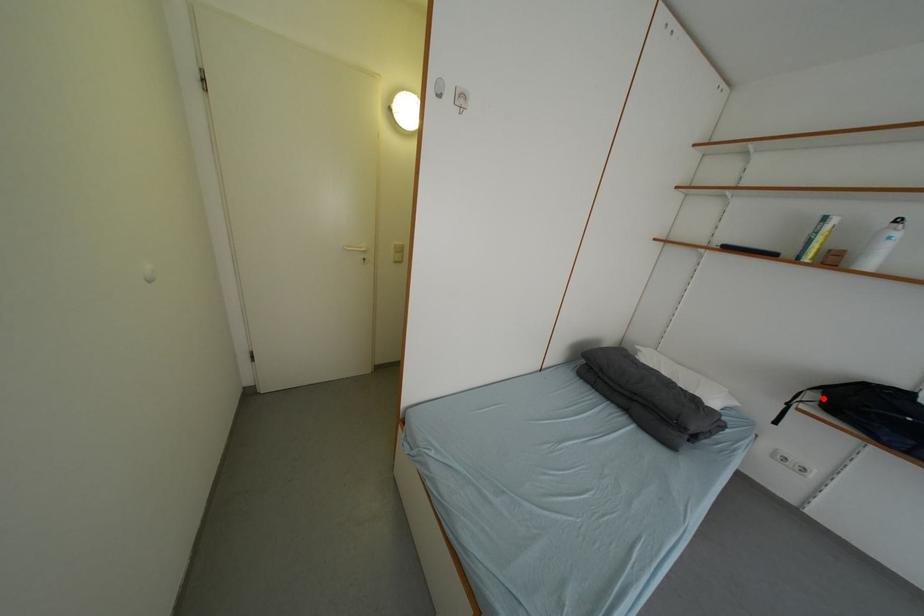
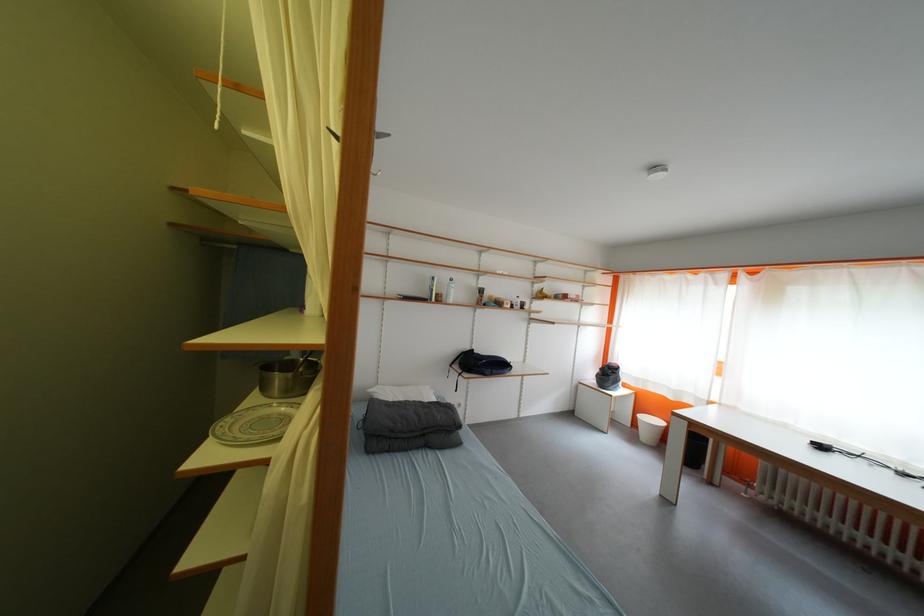
In the second image, find the point that corresponds to the highlighted location in the first image.

(466, 370)